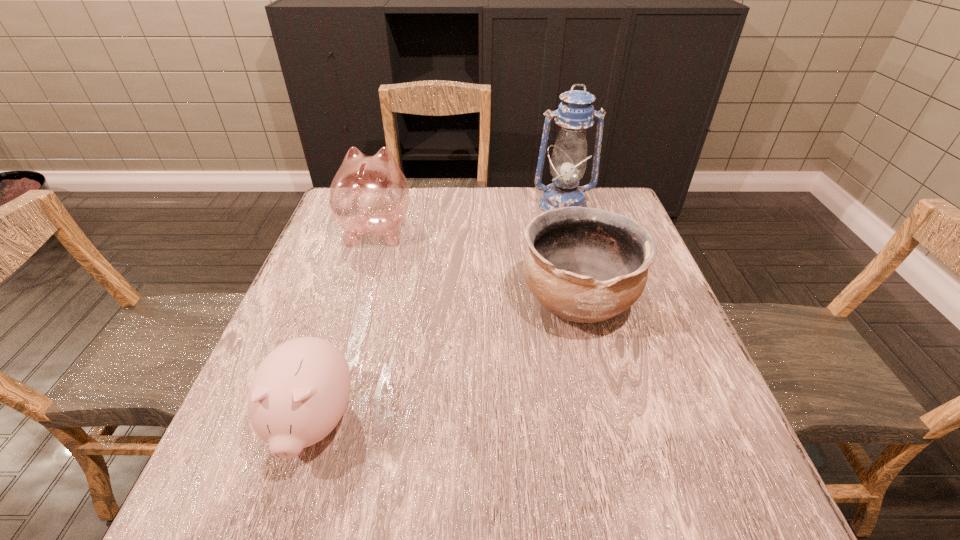
In the image, there is a desktop. Identify the location of vacant space at the near edge. The height and width of the screenshot is (540, 960). (641, 478).

Locate an element on the screen. This screenshot has height=540, width=960. vacant space at the left edge of the desktop is located at coordinates (x=348, y=305).

You are a GUI agent. You are given a task and a screenshot of the screen. Output one action in this format:
    pyautogui.click(x=<x>, y=<y>)
    Task: Click on the free space at the right edge of the desktop
    This screenshot has width=960, height=540.
    Given the screenshot: What is the action you would take?
    pyautogui.click(x=713, y=435)

Locate an element on the screen. free space between the farther piggy bank and the tallest object is located at coordinates (469, 217).

This screenshot has width=960, height=540. Identify the location of free point between the second tallest object and the nearer piggy bank. (345, 326).

You are a GUI agent. You are given a task and a screenshot of the screen. Output one action in this format:
    pyautogui.click(x=<x>, y=<y>)
    Task: Click on the vacant area that lies between the taller piggy bank and the lantern
    The image size is (960, 540).
    Given the screenshot: What is the action you would take?
    pyautogui.click(x=469, y=217)

Locate an element on the screen. free space between the pottery and the nearest object is located at coordinates (445, 362).

Where is `free space between the second tallest object and the lantern`? The image size is (960, 540). free space between the second tallest object and the lantern is located at coordinates (469, 217).

Where is `free area in between the lantern and the nearest object`? free area in between the lantern and the nearest object is located at coordinates (438, 314).

Where is `free spot between the tallest object and the nearer piggy bank`? The image size is (960, 540). free spot between the tallest object and the nearer piggy bank is located at coordinates (438, 314).